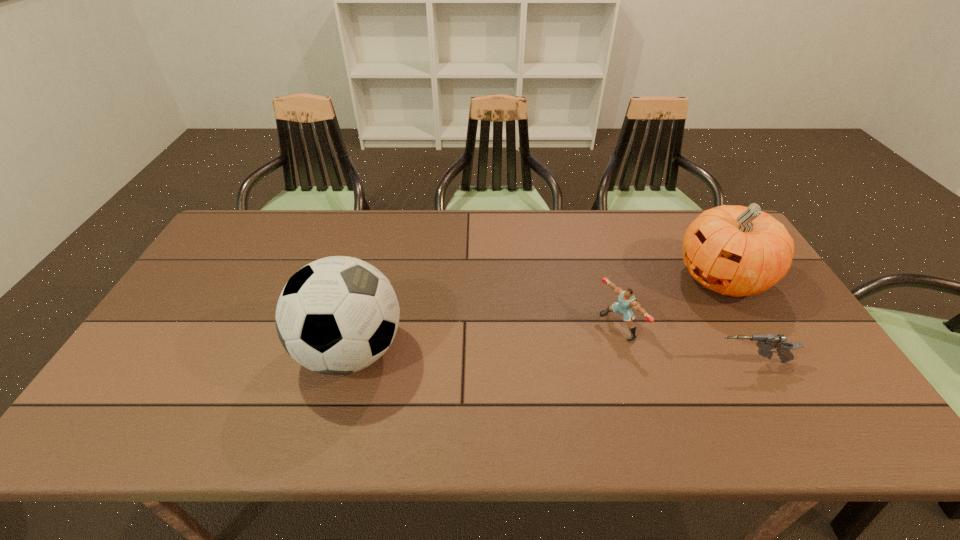
In the image, there is a desktop. Identify the location of vacant space at the far edge. 386,214.

Where is `vacant space at the near edge of the desktop`? The image size is (960, 540). vacant space at the near edge of the desktop is located at coordinates (700, 390).

In order to click on free spot at the left edge of the desktop in this screenshot , I will do `click(175, 322)`.

Identify the location of vacant area at the right edge of the desktop. Image resolution: width=960 pixels, height=540 pixels. (802, 329).

Where is `vacant area at the far left corner`? The image size is (960, 540). vacant area at the far left corner is located at coordinates click(x=252, y=231).

Where is `free location at the near left corner of the desktop`? free location at the near left corner of the desktop is located at coordinates pyautogui.click(x=113, y=402).

In the image, there is a desktop. Where is `free region at the near right corner`? free region at the near right corner is located at coordinates (828, 381).

At what (x,y) coordinates should I click in order to perform the action: click on empty location between the pumpkin and the shortest object. Please return your answer as a coordinate pair (x, y). This screenshot has height=540, width=960. Looking at the image, I should click on (736, 320).

This screenshot has width=960, height=540. Find the location of `vacant area that lies between the pumpkin and the gun`. vacant area that lies between the pumpkin and the gun is located at coordinates (736, 320).

Image resolution: width=960 pixels, height=540 pixels. Identify the location of vacant area that lies between the leftmost object and the second object from left to right. (485, 339).